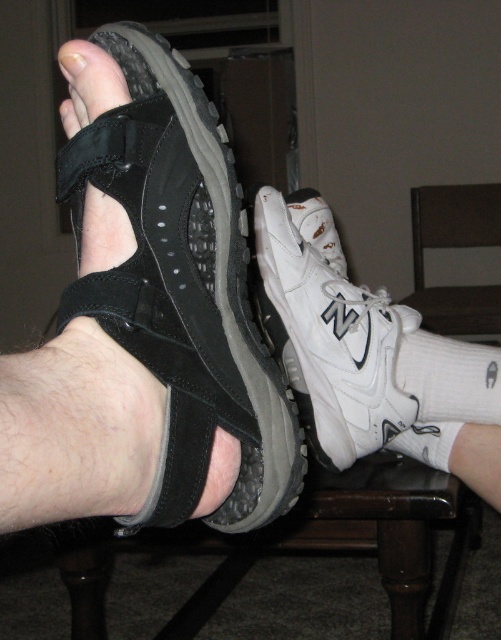
Question: From the image, what is the correct spatial relationship of black suede sandal at left in relation to white fabric at center?

Choices:
 (A) right
 (B) left

Answer: (B)

Question: Which point is closer to the camera taking this photo?

Choices:
 (A) (424, 244)
 (B) (455, 406)

Answer: (B)

Question: Estimate the real-world distances between objects in this image. Which object is closer to the white sock at lower right?

Choices:
 (A) black suede sandal at left
 (B) white fabric at center

Answer: (B)

Question: Observing the image, what is the correct spatial positioning of black suede sandal at left in reference to white mesh shoe at center?

Choices:
 (A) above
 (B) below

Answer: (A)

Question: Can you confirm if black suede sandal at left is positioned above white fabric at center?

Choices:
 (A) yes
 (B) no

Answer: (A)

Question: Among these objects, which one is farthest from the camera?

Choices:
 (A) white mesh shoe at center
 (B) white sock at lower right

Answer: (B)